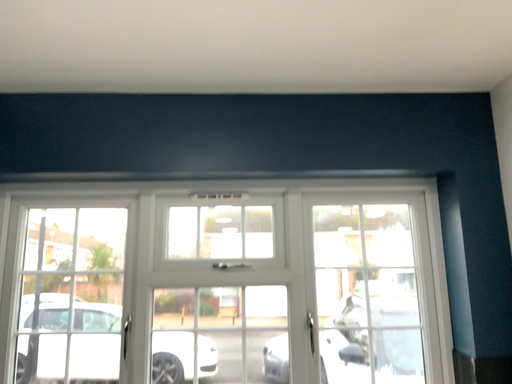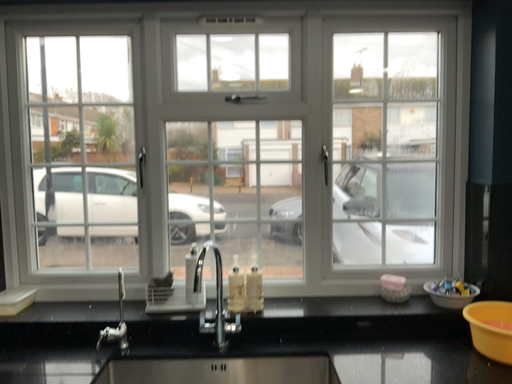
Question: How did the camera likely rotate when shooting the video?

Choices:
 (A) rotated upward
 (B) rotated downward

Answer: (B)